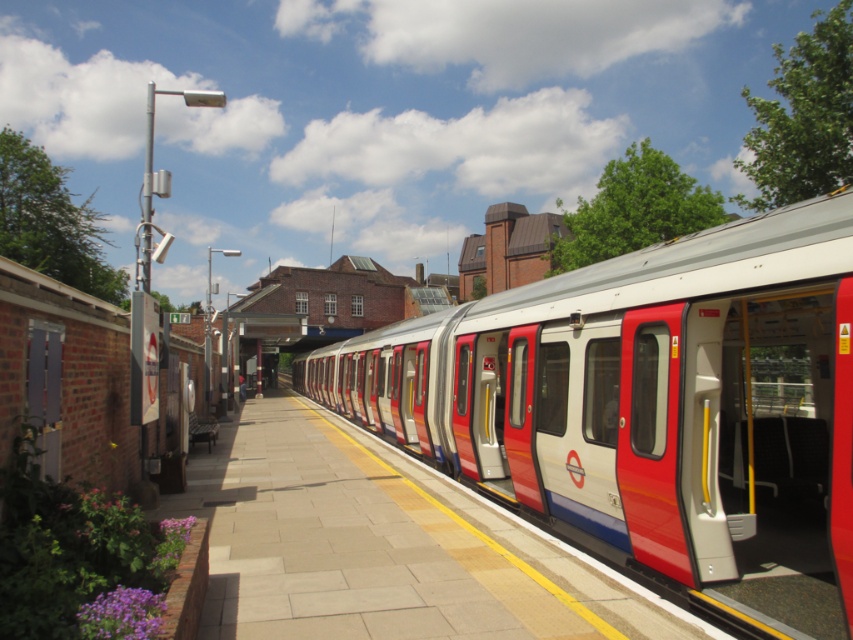
Can you confirm if silver metallic train at center is thinner than smooth concrete platform at center?

In fact, silver metallic train at center might be wider than smooth concrete platform at center.

Which is behind, point (686, 502) or point (314, 436)?

Point (314, 436)

Who is more forward, (808, 352) or (386, 570)?

Positioned in front is point (386, 570).

Where is `silver metallic train at center`? Image resolution: width=853 pixels, height=640 pixels. silver metallic train at center is located at coordinates (651, 408).